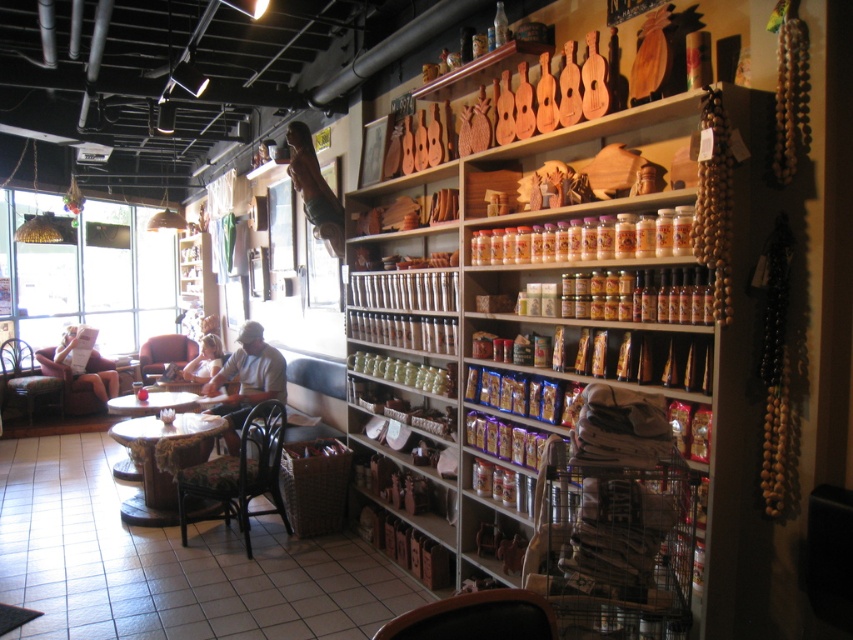
Question: Can you confirm if brown wooden spice rack at center is smaller than velvet-like pink armchair at center-left?

Choices:
 (A) yes
 (B) no

Answer: (A)

Question: Can you confirm if white cotton shirt at center is positioned to the left of white fabric person at center?

Choices:
 (A) no
 (B) yes

Answer: (A)

Question: Estimate the real-world distances between objects in this image. Which object is farther from the velvet-like pink armchair at center-left?

Choices:
 (A) white fabric person at left
 (B) white fabric person at center
 (C) dark brown wood chair at lower left
 (D) wooden table at lower left

Answer: (C)

Question: Observing the image, what is the correct spatial positioning of wooden carved objects at right in reference to wooden table at center?

Choices:
 (A) below
 (B) above

Answer: (B)

Question: Which of these objects is positioned closest to the white cotton shirt at center?

Choices:
 (A) velvet-like pink armchair at center-left
 (B) wooden table at lower left

Answer: (B)

Question: Which object is farther from the camera taking this photo?

Choices:
 (A) dark brown wood chair at lower left
 (B) wooden table at lower left
 (C) white cotton shirt at center

Answer: (B)